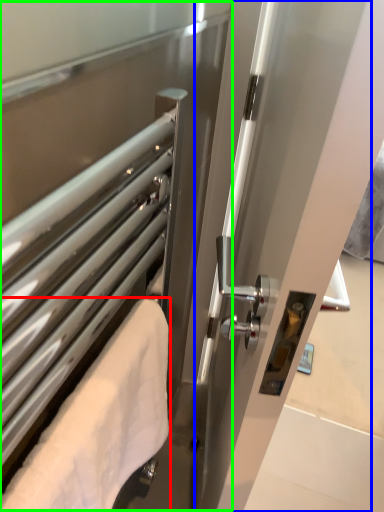
Question: Which is nearer to the towel (highlighted by a red box)? screen door (highlighted by a blue box) or screen door (highlighted by a green box).

Choices:
 (A) screen door
 (B) screen door

Answer: (B)